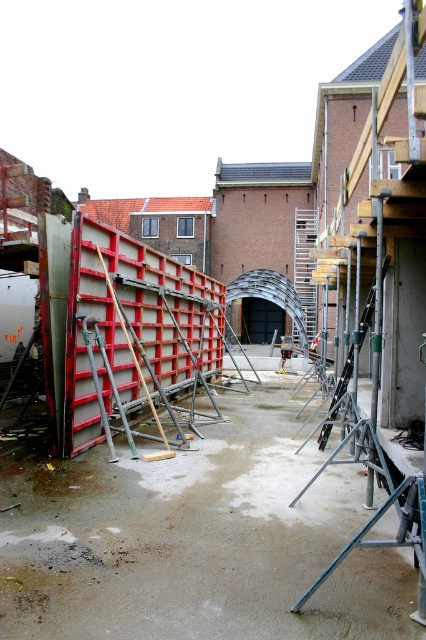
At what (x,y) coordinates should I click in order to perform the action: click on metallic gray barrier at center. Please return your answer as a coordinate pair (x, y). Looking at the image, I should click on (135, 337).

In the scene shown: Is metallic gray barrier at center above metallic silver ladder at center?

Incorrect, metallic gray barrier at center is not positioned above metallic silver ladder at center.

The height and width of the screenshot is (640, 426). Describe the element at coordinates (135, 337) in the screenshot. I see `metallic gray barrier at center` at that location.

Find the location of a particular element. The height and width of the screenshot is (640, 426). metallic gray barrier at center is located at coordinates (135, 337).